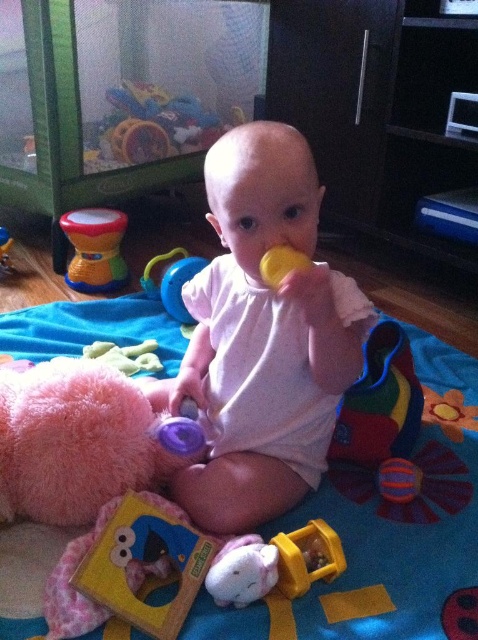
You are a parent trying to place a small toy on the blue soft mat at center so it won t roll off. Considering the height of the mat s edge compared to the multicolored fabric ball at lower right, will the ball stay on the mat?

The blue soft mat at center is much taller than the multicolored fabric ball at lower right, so the ball will stay on the mat because the mat s edge is higher than the ball s height.